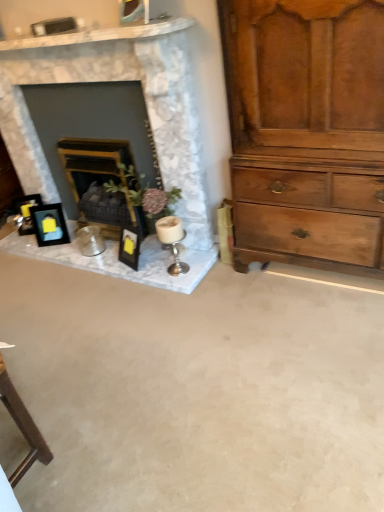
Question: From a real-world perspective, is wooden mantelpiece at center, the 1th fireplace when ordered from right to left, located higher than light brown wooden chest of drawers at right?

Choices:
 (A) yes
 (B) no

Answer: (B)

Question: Is light brown wooden chest of drawers at right at the back of wooden mantelpiece at center, the 1th fireplace when ordered from right to left?

Choices:
 (A) yes
 (B) no

Answer: (B)

Question: From a real-world perspective, is wooden mantelpiece at center, the 1th fireplace when ordered from right to left, under light brown wooden chest of drawers at right?

Choices:
 (A) no
 (B) yes

Answer: (B)

Question: Considering the relative sizes of wooden mantelpiece at center, the 1th fireplace when ordered from right to left, and light brown wooden chest of drawers at right in the image provided, is wooden mantelpiece at center, the 1th fireplace when ordered from right to left, thinner than light brown wooden chest of drawers at right?

Choices:
 (A) yes
 (B) no

Answer: (A)

Question: Considering the relative sizes of wooden mantelpiece at center, the 1th fireplace when ordered from right to left, and light brown wooden chest of drawers at right in the image provided, is wooden mantelpiece at center, the 1th fireplace when ordered from right to left, taller than light brown wooden chest of drawers at right?

Choices:
 (A) yes
 (B) no

Answer: (B)

Question: Is wooden mantelpiece at center, the 1th fireplace when ordered from right to left, aimed at light brown wooden chest of drawers at right?

Choices:
 (A) no
 (B) yes

Answer: (A)

Question: Is matte black picture frame at left, the second picture frame positioned from the right, directly adjacent to light brown wooden chest of drawers at right?

Choices:
 (A) no
 (B) yes

Answer: (A)

Question: Can you confirm if matte black picture frame at left, the second picture frame positioned from the right, is bigger than light brown wooden chest of drawers at right?

Choices:
 (A) no
 (B) yes

Answer: (A)

Question: Is matte black picture frame at left, the second picture frame positioned from the right, outside of light brown wooden chest of drawers at right?

Choices:
 (A) no
 (B) yes

Answer: (B)

Question: From a real-world perspective, is matte black picture frame at left, the second picture frame positioned from the right, on light brown wooden chest of drawers at right?

Choices:
 (A) no
 (B) yes

Answer: (A)

Question: Is matte black picture frame at left, which is counted as the 1th picture frame, starting from the left, in front of light brown wooden chest of drawers at right?

Choices:
 (A) no
 (B) yes

Answer: (A)

Question: Can you confirm if matte black picture frame at left, which is counted as the 1th picture frame, starting from the left, is thinner than light brown wooden chest of drawers at right?

Choices:
 (A) yes
 (B) no

Answer: (A)

Question: Considering the relative sizes of light brown wooden chest of drawers at right and silver metallic candle holder at center in the image provided, is light brown wooden chest of drawers at right taller than silver metallic candle holder at center?

Choices:
 (A) no
 (B) yes

Answer: (B)